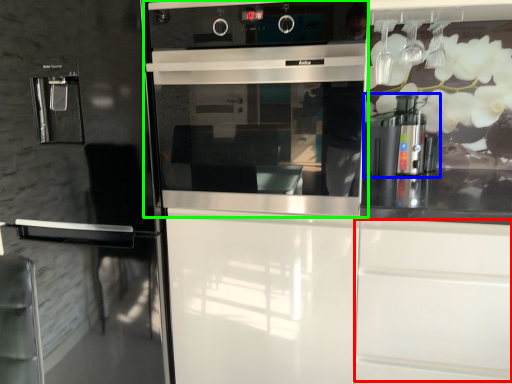
Question: Based on their relative distances, which object is nearer to drawer (highlighted by a red box)? Choose from coffee machine (highlighted by a blue box) and home appliance (highlighted by a green box).

Choices:
 (A) coffee machine
 (B) home appliance

Answer: (B)